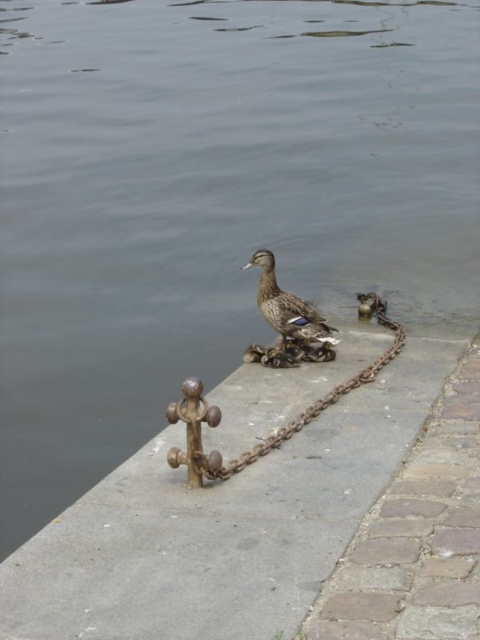
Question: Which object is farther from the camera taking this photo?

Choices:
 (A) rusty metal chain at center
 (B) shiny brown duckling at center

Answer: (B)

Question: Can you confirm if smooth concrete pavement at center is thinner than shiny brown duckling at center?

Choices:
 (A) no
 (B) yes

Answer: (A)

Question: Which point appears farthest from the camera in this image?

Choices:
 (A) (286, 586)
 (B) (381, 360)
 (C) (289, 339)

Answer: (C)

Question: Can you confirm if shiny brown duckling at center is positioned to the left of rusty metal chain at center?

Choices:
 (A) yes
 (B) no

Answer: (A)

Question: Is smooth concrete pavement at center above shiny brown duckling at center?

Choices:
 (A) no
 (B) yes

Answer: (A)

Question: Which point is closer to the camera?

Choices:
 (A) (44, 637)
 (B) (312, 317)

Answer: (A)